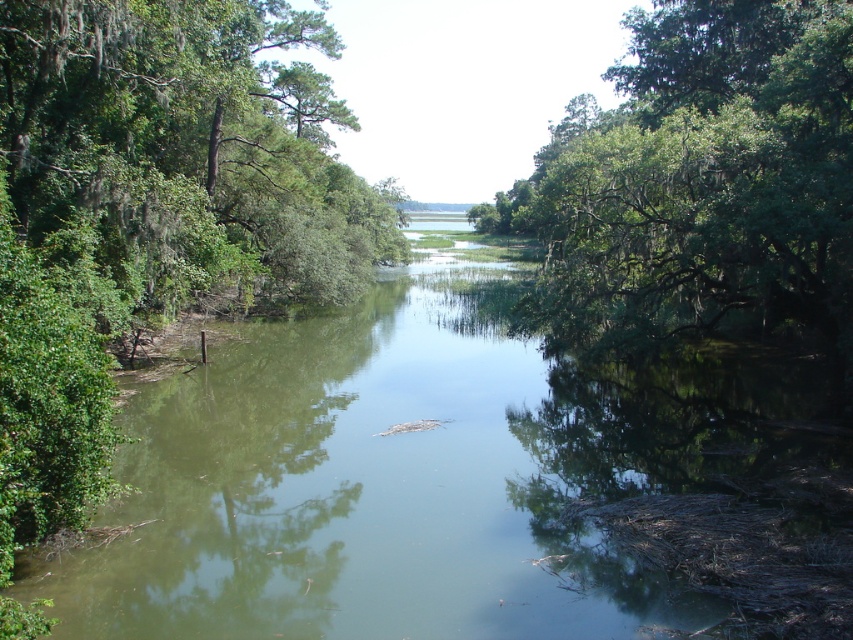
Does green reflective water at center appear over green leafy tree at upper right?

No.

Who is more distant from viewer, (415, 301) or (553, 230)?

Positioned behind is point (415, 301).

Does point (402, 435) come behind point (851, 68)?

That is False.

Locate an element on the screen. This screenshot has width=853, height=640. green reflective water at center is located at coordinates (421, 477).